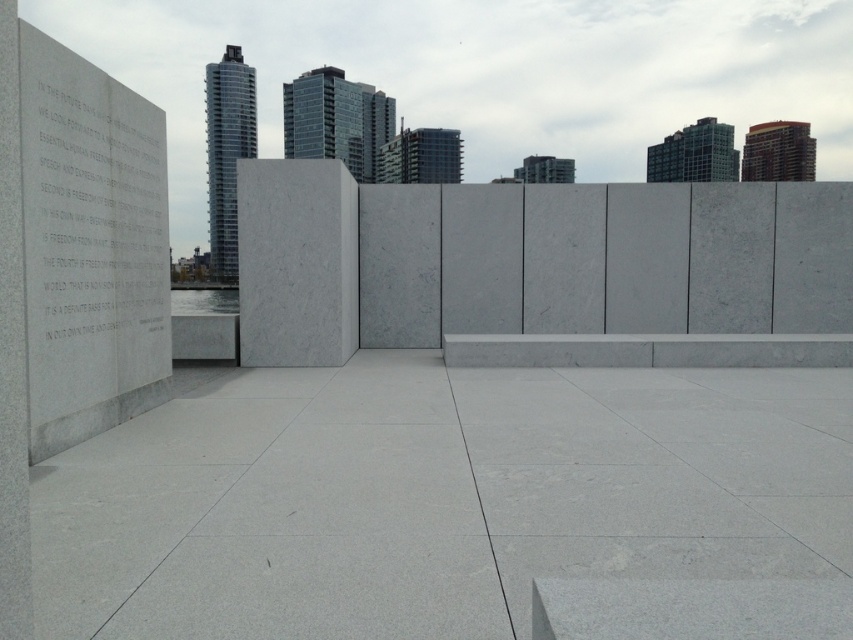
Is the position of gray polished stone plaque at left more distant than that of white marble ledge at center?

That is False.

Which is above, gray polished stone plaque at left or white marble ledge at center?

gray polished stone plaque at left

The image size is (853, 640). Describe the element at coordinates (90, 246) in the screenshot. I see `gray polished stone plaque at left` at that location.

Find the location of a particular element. The image size is (853, 640). gray polished stone plaque at left is located at coordinates (90, 246).

Does point (274, 484) come farther from viewer compared to point (688, 349)?

That is False.

Find the location of `gray polished concrete at left`. gray polished concrete at left is located at coordinates (433, 497).

Is white marble plaque at left further to the viewer compared to white marble ledge at center?

That is False.

Does white marble plaque at left have a greater width compared to white marble ledge at center?

No, white marble plaque at left is not wider than white marble ledge at center.

Locate an element on the screen. This screenshot has height=640, width=853. white marble plaque at left is located at coordinates (94, 212).